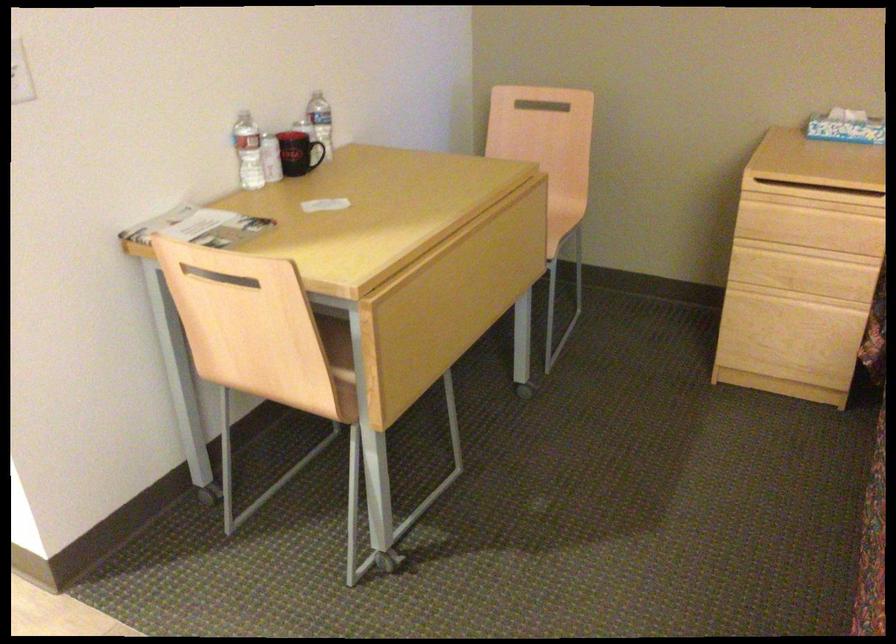
Find where to lift the black mug handle. Please return your answer as a coordinate pair (x, y).

(321, 153)